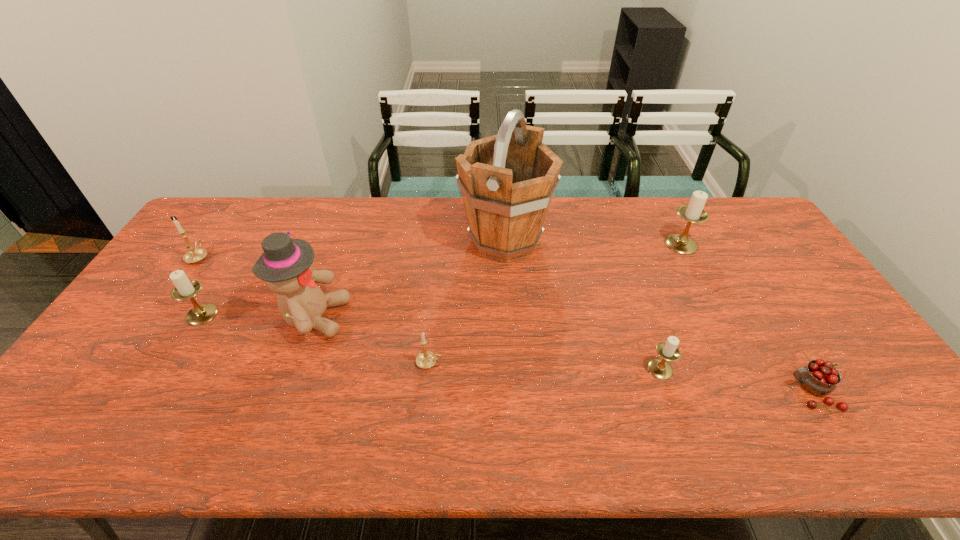
The height and width of the screenshot is (540, 960). Identify the location of object that is at the left edge. (196, 254).

This screenshot has height=540, width=960. I want to click on object located in the right edge section of the desktop, so click(x=819, y=377).

Locate an element on the screen. vacant space at the far edge of the desktop is located at coordinates (672, 198).

Where is `vacant space at the left edge of the desktop`? This screenshot has height=540, width=960. vacant space at the left edge of the desktop is located at coordinates (200, 279).

Image resolution: width=960 pixels, height=540 pixels. Identify the location of vacant space at the right edge. (754, 260).

Where is `free point between the bucket and the nearest white candle holder`? The height and width of the screenshot is (540, 960). free point between the bucket and the nearest white candle holder is located at coordinates (583, 305).

Locate an element on the screen. Image resolution: width=960 pixels, height=540 pixels. empty space that is in between the left gold candle holder and the red cherry is located at coordinates (505, 324).

Locate an element on the screen. vacant point located between the left gold candle holder and the second tallest object is located at coordinates (256, 287).

Locate an element on the screen. The width and height of the screenshot is (960, 540). free spot between the seventh object from left to right and the red cherry is located at coordinates (747, 318).

Where is `empty space between the rightmost object and the smaller gold candle holder`? This screenshot has width=960, height=540. empty space between the rightmost object and the smaller gold candle holder is located at coordinates (621, 377).